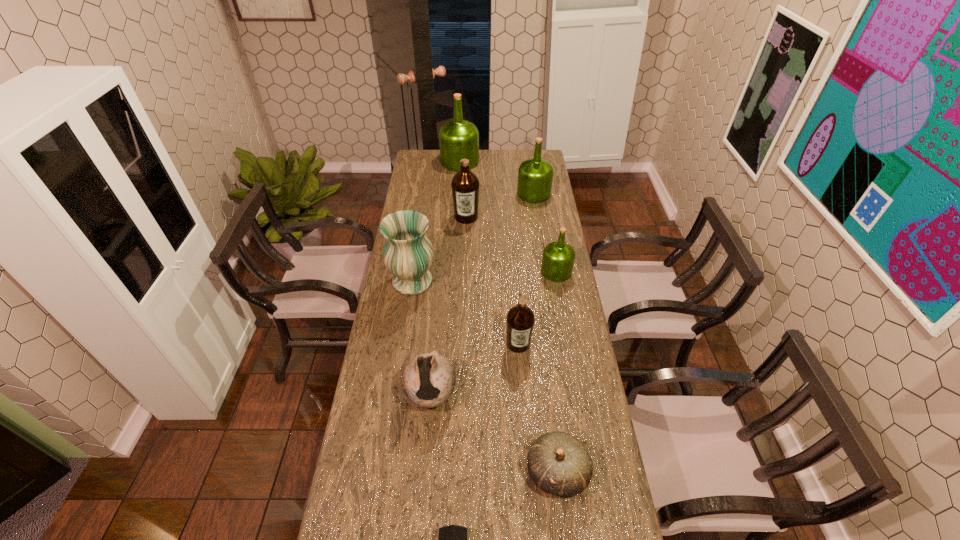
Identify the location of the tallest object. Image resolution: width=960 pixels, height=540 pixels. pyautogui.click(x=458, y=139).

You are a GUI agent. You are given a task and a screenshot of the screen. Output one action in this format:
    pyautogui.click(x=<x>, y=<y>)
    Task: Click on the biggest green olive oil
    
    Given the screenshot: What is the action you would take?
    pyautogui.click(x=458, y=139)

This screenshot has height=540, width=960. In order to click on the second nearest green olive oil in this screenshot , I will do `click(535, 176)`.

Where is `the second biggest green olive oil`? This screenshot has height=540, width=960. the second biggest green olive oil is located at coordinates (535, 176).

You are a GUI agent. You are given a task and a screenshot of the screen. Output one action in this format:
    pyautogui.click(x=<x>, y=<y>)
    Task: Click on the left brown olive oil
    
    Given the screenshot: What is the action you would take?
    pyautogui.click(x=465, y=184)

The width and height of the screenshot is (960, 540). Find the location of `the farther brown olive oil`. the farther brown olive oil is located at coordinates (465, 184).

Where is `vase`? This screenshot has width=960, height=540. vase is located at coordinates (408, 254).

Where is `the nearer brown olive oil`? the nearer brown olive oil is located at coordinates (520, 319).

Image resolution: width=960 pixels, height=540 pixels. Identify the location of the smaller brown olive oil. (520, 319).

This screenshot has height=540, width=960. Identify the location of the nearest green olive oil. (558, 258).